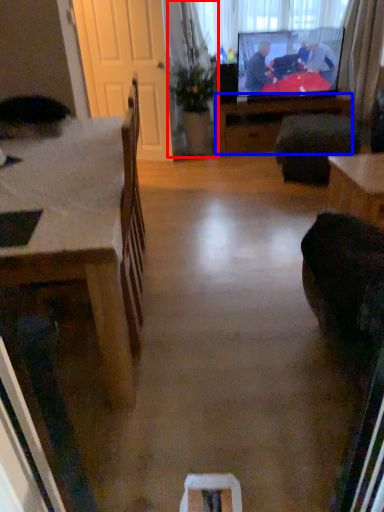
Question: Among these objects, which one is nearest to the camera, houseplant (highlighted by a red box) or table (highlighted by a blue box)?

Choices:
 (A) houseplant
 (B) table

Answer: (A)